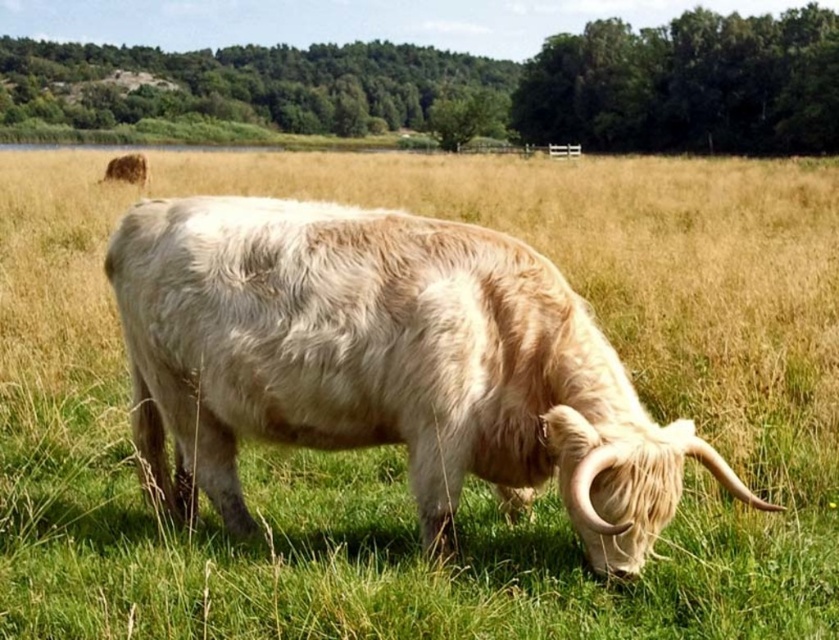
You are standing at the point marked by the coordinates point (386, 364). Looking around, you see a Highland cow grazing in the field. What animal are you closest to?

The point (386, 364) indicates white woolly bull at center, so you are closest to the Highland cow.

You are a photographer standing at the edge of a field where a white woolly bull at center is grazing. You want to take a closeup photo of the bull without disturbing it. If your camera has a maximum zoom range of 7 feet, can you capture a closeup without moving closer?

The white woolly bull at center is 8.12 feet away from the camera. Since the maximum zoom range is 7 feet, the camera cannot capture a closeup at that distance. You need to move closer or use a camera with a longer zoom range.

You are a photographer standing in the field. You want to take a photo that includes both the white woolly bull at center and the fuzzy brown yak at upper left. Which animal will appear larger in the photo?

The white woolly bull at center will appear larger in the photo because it is closer to the viewer than the fuzzy brown yak at upper left.